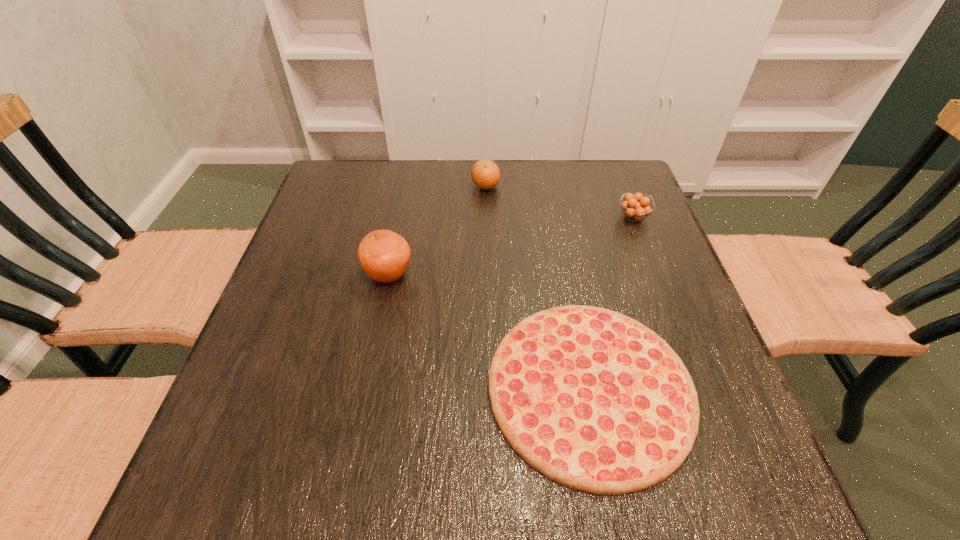
This screenshot has height=540, width=960. Find the location of `vacant area at the far left corner`. vacant area at the far left corner is located at coordinates (325, 196).

Identify the location of vacant space at the near left corner of the desktop. This screenshot has width=960, height=540. (276, 455).

What are the coordinates of `free space at the far right corner of the desktop` in the screenshot? It's located at (614, 189).

Where is `unoccupied position between the pizza and the leftmost object`? The image size is (960, 540). unoccupied position between the pizza and the leftmost object is located at coordinates (490, 331).

The height and width of the screenshot is (540, 960). In order to click on free point between the nearest object and the second shortest object in this screenshot , I will do `click(612, 302)`.

Identify the location of vacant space that's between the pizza and the tallest object. The height and width of the screenshot is (540, 960). (490, 331).

Identify the location of free area in between the second tallest object and the tallest orange fruit. The image size is (960, 540). (437, 231).

Identify the location of free spot between the second shortest object and the leftmost orange fruit. (511, 246).

You are a GUI agent. You are given a task and a screenshot of the screen. Output one action in this format:
    pyautogui.click(x=<x>, y=<y>)
    Task: Click on the vacant space that is in between the second nearest object and the nearest object
    
    Given the screenshot: What is the action you would take?
    pyautogui.click(x=490, y=331)

You are a GUI agent. You are given a task and a screenshot of the screen. Output one action in this format:
    pyautogui.click(x=<x>, y=<y>)
    Task: Click on the vacant area between the pizza and the farthest orange fruit
    The image size is (960, 540).
    Given the screenshot: What is the action you would take?
    pyautogui.click(x=538, y=287)